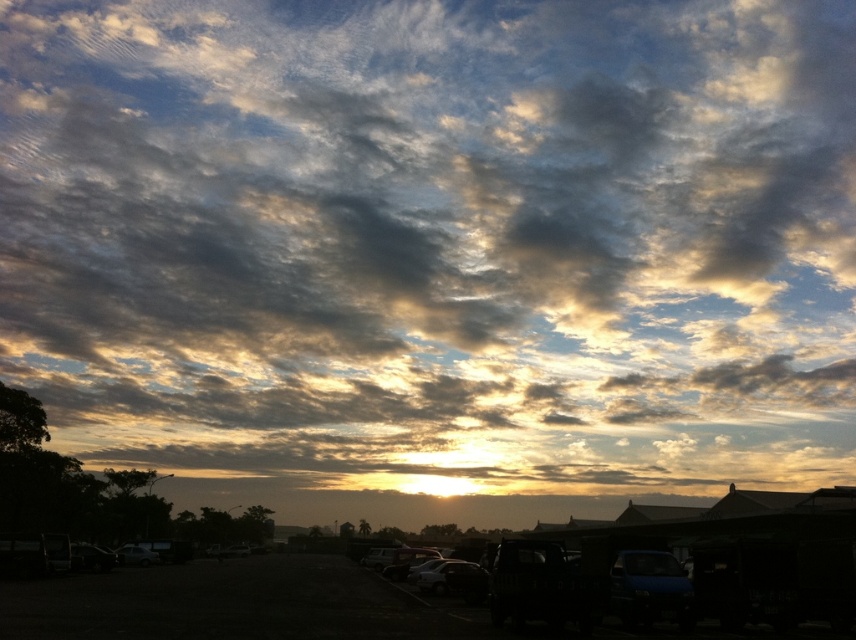
Between white matte car at center and shiny silver car at center, which one is positioned higher?

white matte car at center is above.

Does white matte car at center have a greater height compared to shiny silver car at center?

In fact, white matte car at center may be shorter than shiny silver car at center.

Who is more distant from viewer, (468, 580) or (407, 564)?

Point (407, 564)

Where is `white matte car at center`? This screenshot has height=640, width=856. white matte car at center is located at coordinates (x=453, y=579).

Does shiny silver car at center have a lesser width compared to matte black car at lower left?

In fact, shiny silver car at center might be wider than matte black car at lower left.

From the picture: Who is more forward, (389, 564) or (116, 548)?

Point (389, 564) is in front.

Where is `shiny silver car at center`? The height and width of the screenshot is (640, 856). shiny silver car at center is located at coordinates (406, 561).

Between white matte car at center and matte black car at lower left, which one appears on the right side from the viewer's perspective?

Positioned to the right is white matte car at center.

Describe the element at coordinates (453, 579) in the screenshot. I see `white matte car at center` at that location.

Looking at this image, who is more forward, (482, 593) or (141, 547)?

Positioned in front is point (482, 593).

Find the location of a particular element. The image size is (856, 640). white matte car at center is located at coordinates (453, 579).